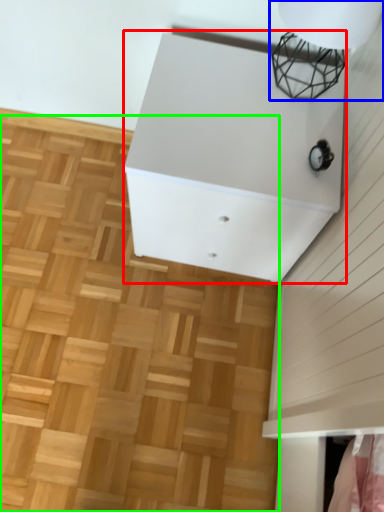
Question: Which object is the farthest from furniture (highlighted by a red box)? Choose among these: lamp (highlighted by a blue box) or hardwood (highlighted by a green box).

Choices:
 (A) lamp
 (B) hardwood

Answer: (B)